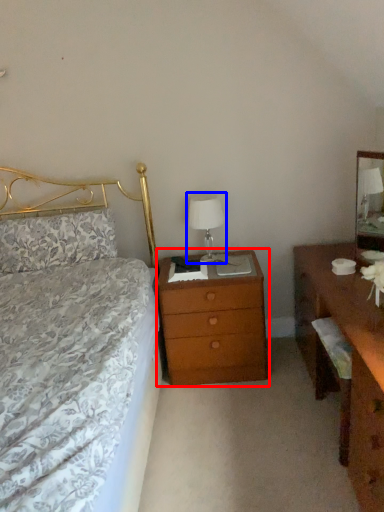
Question: Among these objects, which one is nearest to the camera, nightstand (highlighted by a red box) or bedside lamp (highlighted by a blue box)?

Choices:
 (A) nightstand
 (B) bedside lamp

Answer: (A)